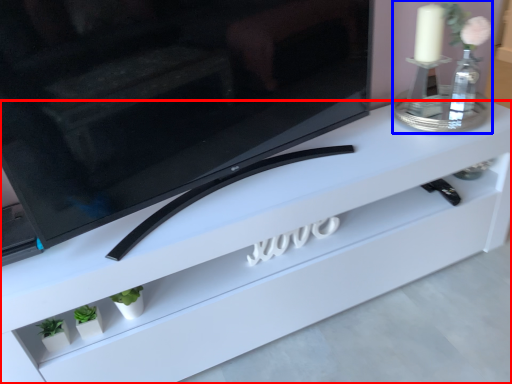
Question: Which object appears farthest to the camera in this image, furniture (highlighted by a red box) or candle holder (highlighted by a blue box)?

Choices:
 (A) furniture
 (B) candle holder

Answer: (B)